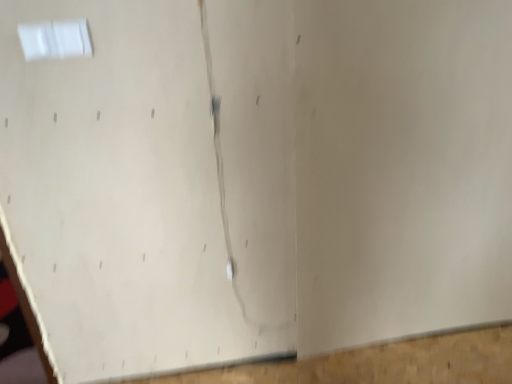
Describe the element at coordinates (381, 362) in the screenshot. I see `wooden at bottom` at that location.

Where is `wooden at bottom`? The height and width of the screenshot is (384, 512). wooden at bottom is located at coordinates (381, 362).

This screenshot has width=512, height=384. I want to click on white plastic window at upper left, so pyautogui.click(x=55, y=39).

What do you see at coordinates (55, 39) in the screenshot?
I see `white plastic window at upper left` at bounding box center [55, 39].

Find the location of a particular element. wooden at bottom is located at coordinates (381, 362).

Is white plastic window at upper left to the left of wooden at bottom from the viewer's perspective?

Indeed, white plastic window at upper left is positioned on the left side of wooden at bottom.

Looking at this image, which object is closer to the camera, white plastic window at upper left or wooden at bottom?

white plastic window at upper left is closer to the camera.

Does point (46, 38) appear closer or farther from the camera than point (396, 370)?

Point (46, 38).

From the image's perspective, relative to wooden at bottom, is white plastic window at upper left above or below?

Clearly, from the image's perspective, white plastic window at upper left is above wooden at bottom.

From a real-world perspective, between white plastic window at upper left and wooden at bottom, who is vertically lower?

wooden at bottom, from a real-world perspective.

Considering the sizes of objects white plastic window at upper left and wooden at bottom in the image provided, who is wider, white plastic window at upper left or wooden at bottom?

With larger width is wooden at bottom.

Between white plastic window at upper left and wooden at bottom, which one has more height?

Standing taller between the two is white plastic window at upper left.

Which of these two, white plastic window at upper left or wooden at bottom, is bigger?

With larger size is wooden at bottom.

From the picture: Would you say white plastic window at upper left contains wooden at bottom?

No, wooden at bottom is located outside of white plastic window at upper left.

Is white plastic window at upper left placed right next to wooden at bottom?

No, white plastic window at upper left is not next to wooden at bottom.

Is white plastic window at upper left facing towards wooden at bottom?

No, white plastic window at upper left does not turn towards wooden at bottom.

Can you tell me how much white plastic window at upper left and wooden at bottom differ in facing direction?

178 degrees.

This screenshot has width=512, height=384. I want to click on plywood below the white plastic window at upper left (from the image's perspective), so click(x=381, y=362).

Is wooden at bottom to the left of white plastic window at upper left from the viewer's perspective?

Incorrect, wooden at bottom is not on the left side of white plastic window at upper left.

Is the depth of wooden at bottom less than that of white plastic window at upper left?

No, it is not.

Between point (442, 377) and point (38, 27), which one is positioned in front?

Point (38, 27)

From the image's perspective, which is below, wooden at bottom or white plastic window at upper left?

From the image's view, wooden at bottom is below.

From a real-world perspective, is wooden at bottom positioned above or below white plastic window at upper left?

In terms of real-world spatial position, wooden at bottom is below white plastic window at upper left.

Considering the sizes of objects wooden at bottom and white plastic window at upper left in the image provided, who is thinner, wooden at bottom or white plastic window at upper left?

white plastic window at upper left.

Considering the sizes of wooden at bottom and white plastic window at upper left in the image, is wooden at bottom taller or shorter than white plastic window at upper left?

Considering their sizes, wooden at bottom has less height than white plastic window at upper left.

Is wooden at bottom smaller than white plastic window at upper left?

No.

Is wooden at bottom spatially inside white plastic window at upper left, or outside of it?

wooden at bottom is outside white plastic window at upper left.

Is wooden at bottom next to white plastic window at upper left and touching it?

wooden at bottom is not next to white plastic window at upper left, and they're not touching.

Is white plastic window at upper left at the back of wooden at bottom?

wooden at bottom is not turned away from white plastic window at upper left.

Based on the photo, can you tell me how much wooden at bottom and white plastic window at upper left differ in facing direction?

They differ by 178 degrees in their facing directions.

At what (x,y) coordinates should I click in order to perform the action: click on plywood below the white plastic window at upper left (from a real-world perspective). Please return your answer as a coordinate pair (x, y). Looking at the image, I should click on (381, 362).

At what (x,y) coordinates should I click in order to perform the action: click on plywood directly beneath the white plastic window at upper left (from a real-world perspective). Please return your answer as a coordinate pair (x, y). This screenshot has height=384, width=512. Looking at the image, I should click on (381, 362).

This screenshot has height=384, width=512. I want to click on plywood on the right of white plastic window at upper left, so click(381, 362).